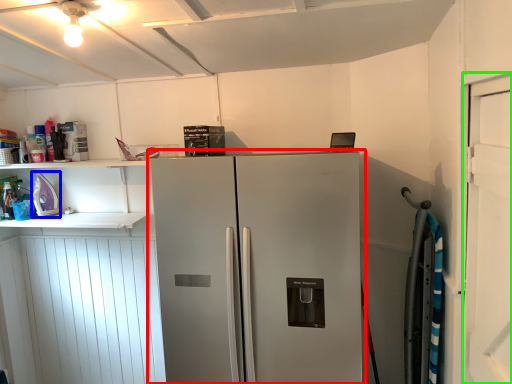
Question: Which object is the farthest from refrigerator (highlighted by a red box)? Choose among these: appliance (highlighted by a blue box) or door (highlighted by a green box).

Choices:
 (A) appliance
 (B) door

Answer: (A)